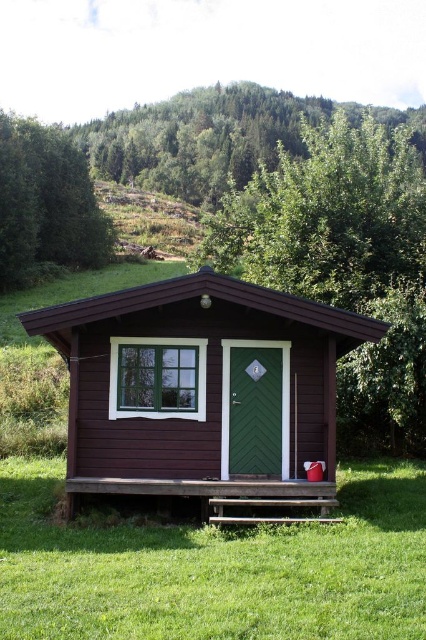
Does dark brown wood cabin at center have a smaller size compared to green wood tree at center?

Indeed, dark brown wood cabin at center has a smaller size compared to green wood tree at center.

Can you confirm if dark brown wood cabin at center is positioned to the left of green wood tree at center?

Indeed, dark brown wood cabin at center is positioned on the left side of green wood tree at center.

Between point (232, 323) and point (276, 278), which one is positioned in front?

Positioned in front is point (232, 323).

Where is `dark brown wood cabin at center`? The width and height of the screenshot is (426, 640). dark brown wood cabin at center is located at coordinates (199, 387).

Does dark brown wood cabin at center have a lesser width compared to green leafy tree at upper center?

Yes.

Does dark brown wood cabin at center have a greater width compared to green leafy tree at upper center?

No.

Between point (155, 340) and point (207, 202), which one is positioned in front?

Point (155, 340) is more forward.

This screenshot has height=640, width=426. In order to click on dark brown wood cabin at center in this screenshot , I will do `click(199, 387)`.

Is green leafy tree at upper center below green textured tree at upper left?

No.

Does point (244, 132) lie in front of point (80, 246)?

No, it is not.

Which is in front, point (129, 122) or point (63, 179)?

Positioned in front is point (63, 179).

Find the location of `green leafy tree at upper center`. green leafy tree at upper center is located at coordinates (215, 136).